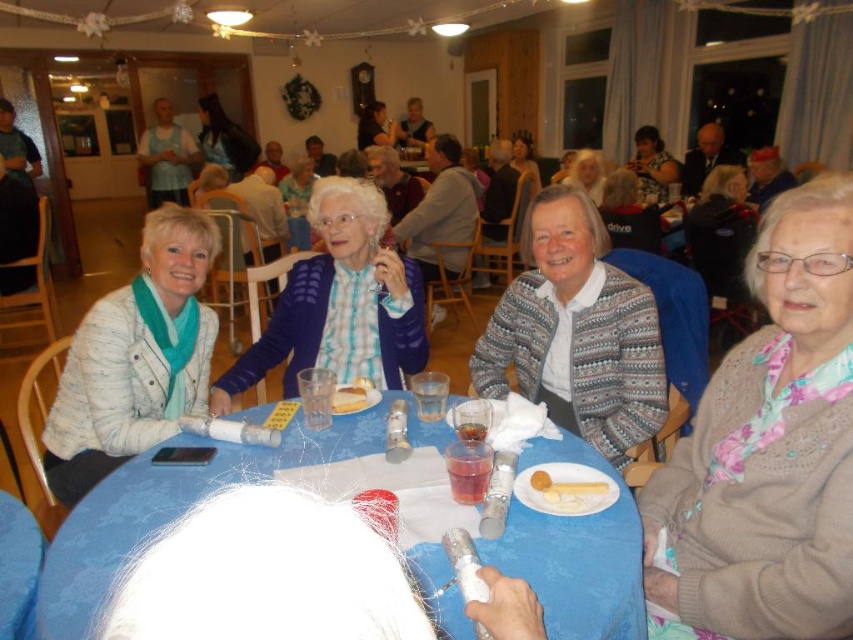
You are a guest at the party and want to pick up the white paper plate at center without moving from your current position near the matte gray sweater at center. Can you reach it?

The matte gray sweater at center is 3.45 meters away from the white paper plate at center. Since the distance is too far to reach, you cannot pick up the white paper plate at center without moving.

You are a photographer at the event and want to capture both the matte gray sweater at center and the matte gray sweater at upper center in a single shot. Which sweater should you focus on first to ensure both are in focus?

You should focus on the matte gray sweater at center first since it is closer to the viewer, allowing the matte gray sweater at upper center to also be in focus due to the depth of field.